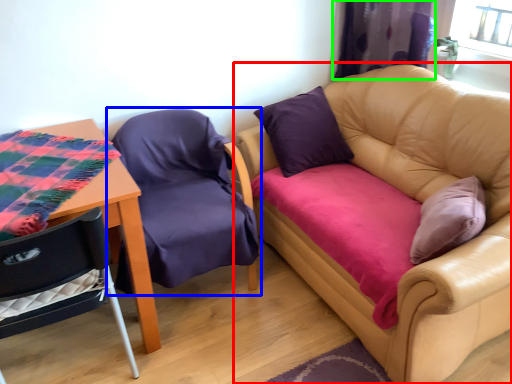
Question: Which is farther away from studio couch (highlighted by a red box)? chair (highlighted by a blue box) or curtain (highlighted by a green box)?

Choices:
 (A) chair
 (B) curtain

Answer: (A)